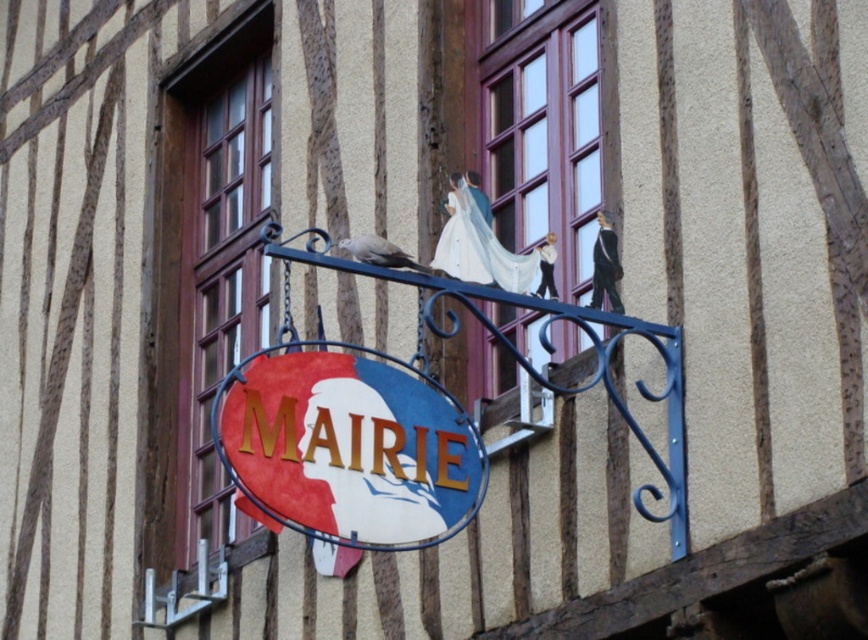
You are standing in front of the traditional half timbered building and looking at the signboard. There is a point at coordinates point (x=542, y=129). Where is this point located?

The point (x=542, y=129) is on wooden window frame at upper center.

You are standing in front of a traditional half timbered building with a circular signboard. You see a wooden window frame at upper center and a white satin dress at center. Which object is higher up?

The wooden window frame at upper center is located above the white satin dress at center, so the wooden window frame at upper center is higher up.